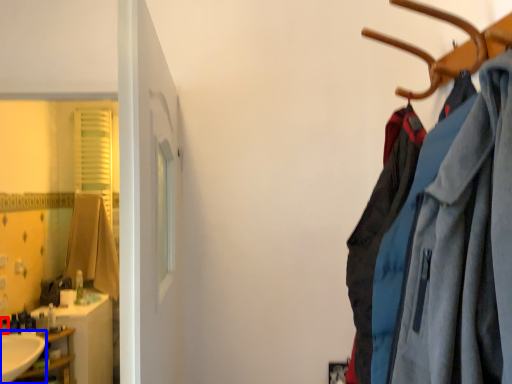
Question: Which object appears closest to the camera in this image, toiletry (highlighted by a red box) or sink (highlighted by a blue box)?

Choices:
 (A) toiletry
 (B) sink

Answer: (B)